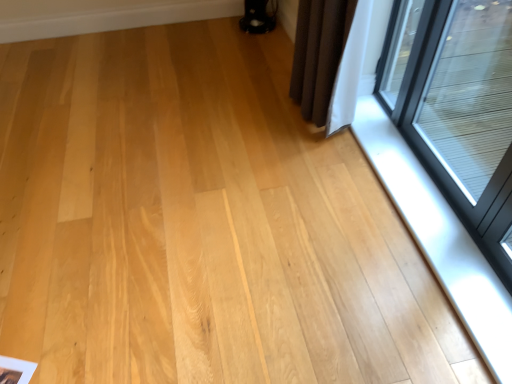
Question: Does transparent glass window at upper right have a larger size compared to satin silver window sill at lower right?

Choices:
 (A) no
 (B) yes

Answer: (B)

Question: Does transparent glass window at upper right have a lesser width compared to satin silver window sill at lower right?

Choices:
 (A) yes
 (B) no

Answer: (A)

Question: Is transparent glass window at upper right in front of satin silver window sill at lower right?

Choices:
 (A) no
 (B) yes

Answer: (B)

Question: Is transparent glass window at upper right wider than satin silver window sill at lower right?

Choices:
 (A) no
 (B) yes

Answer: (A)

Question: From a real-world perspective, does transparent glass window at upper right stand above satin silver window sill at lower right?

Choices:
 (A) yes
 (B) no

Answer: (A)

Question: Is transparent glass window at upper right taller than satin silver window sill at lower right?

Choices:
 (A) yes
 (B) no

Answer: (A)

Question: Could you tell me if satin silver window sill at lower right is turned towards transparent glass window at upper right?

Choices:
 (A) no
 (B) yes

Answer: (A)

Question: Considering the relative sizes of satin silver window sill at lower right and transparent glass window at upper right in the image provided, is satin silver window sill at lower right taller than transparent glass window at upper right?

Choices:
 (A) no
 (B) yes

Answer: (A)

Question: Is satin silver window sill at lower right oriented away from transparent glass window at upper right?

Choices:
 (A) yes
 (B) no

Answer: (B)

Question: Could transparent glass window at upper right be considered to be inside satin silver window sill at lower right?

Choices:
 (A) no
 (B) yes

Answer: (A)

Question: Is satin silver window sill at lower right directly adjacent to transparent glass window at upper right?

Choices:
 (A) no
 (B) yes

Answer: (A)

Question: Considering the relative sizes of satin silver window sill at lower right and transparent glass window at upper right in the image provided, is satin silver window sill at lower right smaller than transparent glass window at upper right?

Choices:
 (A) yes
 (B) no

Answer: (A)

Question: Considering their positions, is transparent glass window at upper right located in front of or behind satin silver window sill at lower right?

Choices:
 (A) front
 (B) behind

Answer: (A)